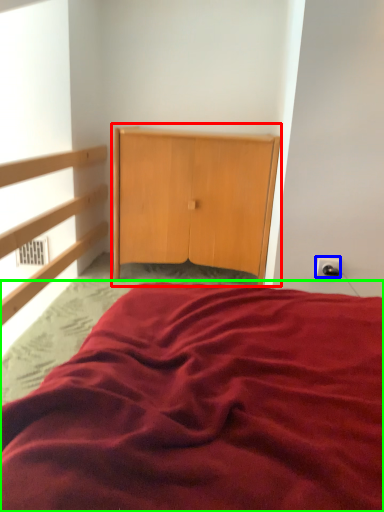
Question: Which object is positioned farthest from dresser (highlighted by a red box)? Select from electric outlet (highlighted by a blue box) and bed (highlighted by a green box).

Choices:
 (A) electric outlet
 (B) bed

Answer: (B)